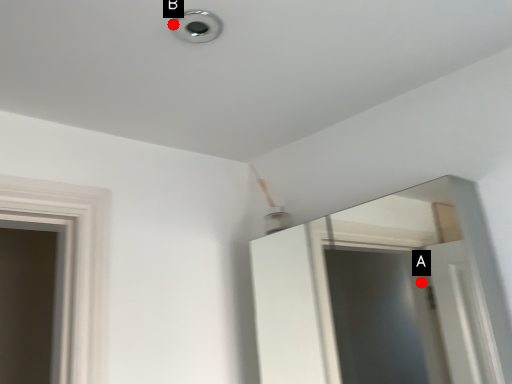
Question: Two points are circled on the image, labeled by A and B beside each circle. Which point appears closest to the camera in this image?

Choices:
 (A) A is closer
 (B) B is closer

Answer: (B)